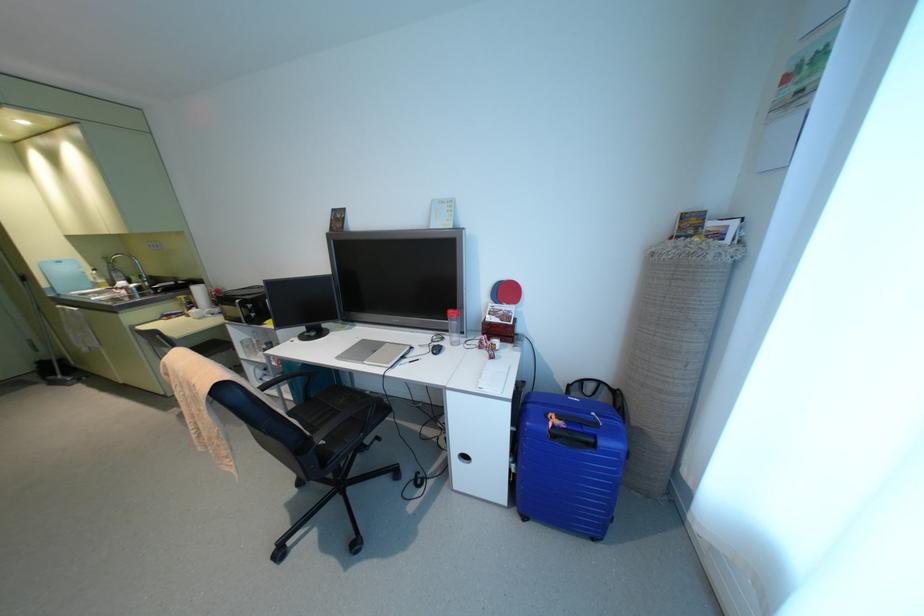
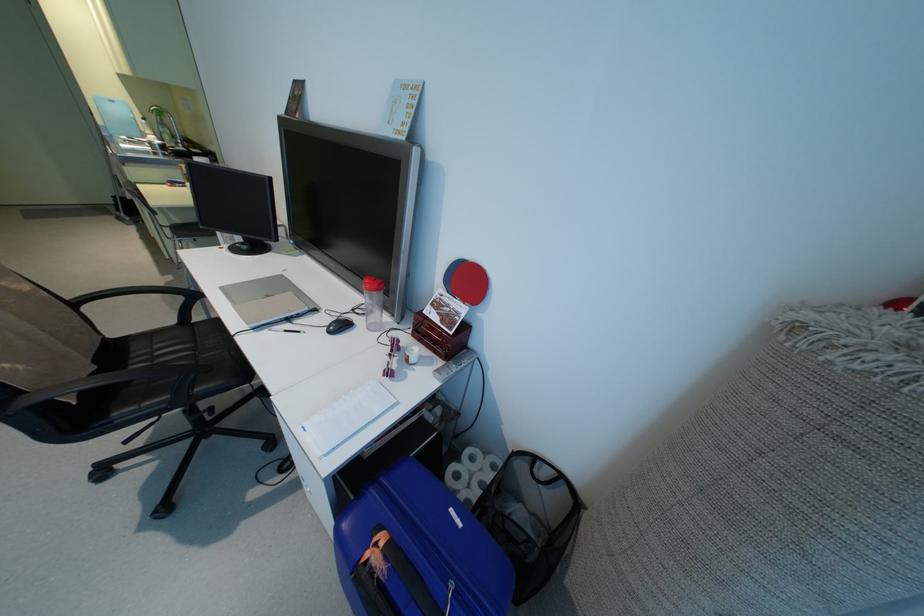
Which direction would the cameraman need to move to produce the second image?

The cameraman walked toward right, forward.